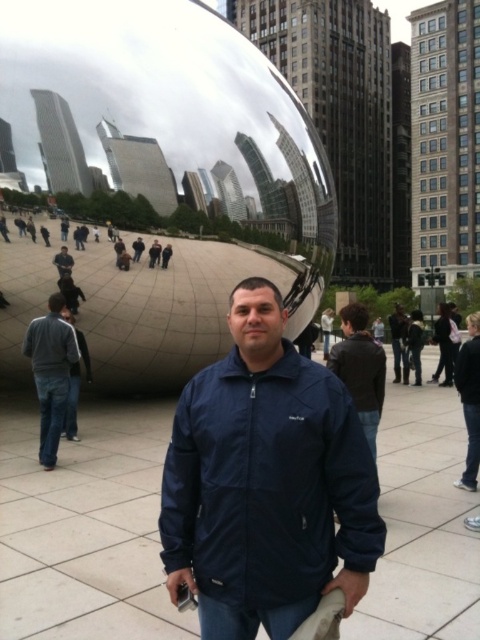
You are a photographer standing at the base of Cloud Gate. You want to take a photo of the dark gray sweater at left and the dark brown hair at center so that both are in focus. The camera you are using has a depth of field that can cover 30 feet. Will both subjects be in focus if they are positioned as shown?

The dark gray sweater at left is 30.68 feet from the dark brown hair at center. Since the distance between them exceeds the camera depth of field of 30 feet, both subjects may not be in focus simultaneously.

You are a photographer trying to capture a portrait of the man in the scene. Since the matte blue jacket at center and dark brown hair at center are both in focus, which one is closer to the camera?

The matte blue jacket at center is positioned under dark brown hair at center, so the dark brown hair at center is closer to the camera.